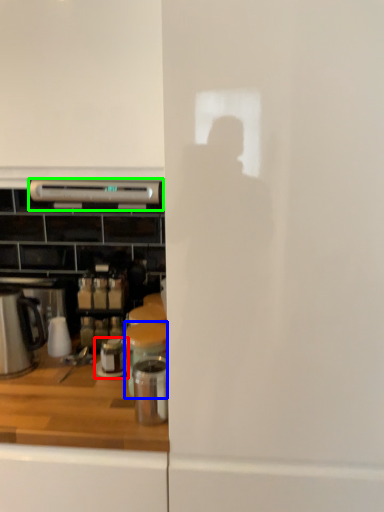
Question: Which object is the farthest from appliance (highlighted by a red box)? Choose among these: appliance (highlighted by a blue box) or kitchen appliance (highlighted by a green box).

Choices:
 (A) appliance
 (B) kitchen appliance

Answer: (B)